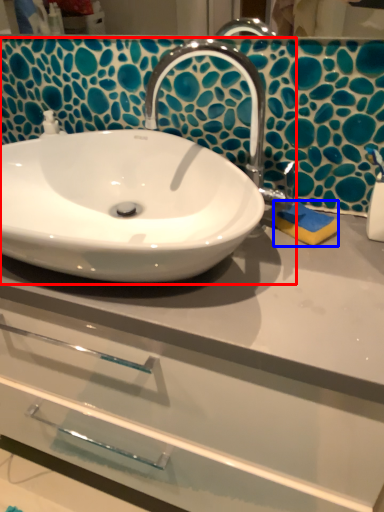
Question: Among these objects, which one is nearest to the camera, sink (highlighted by a red box) or soap (highlighted by a blue box)?

Choices:
 (A) sink
 (B) soap

Answer: (A)